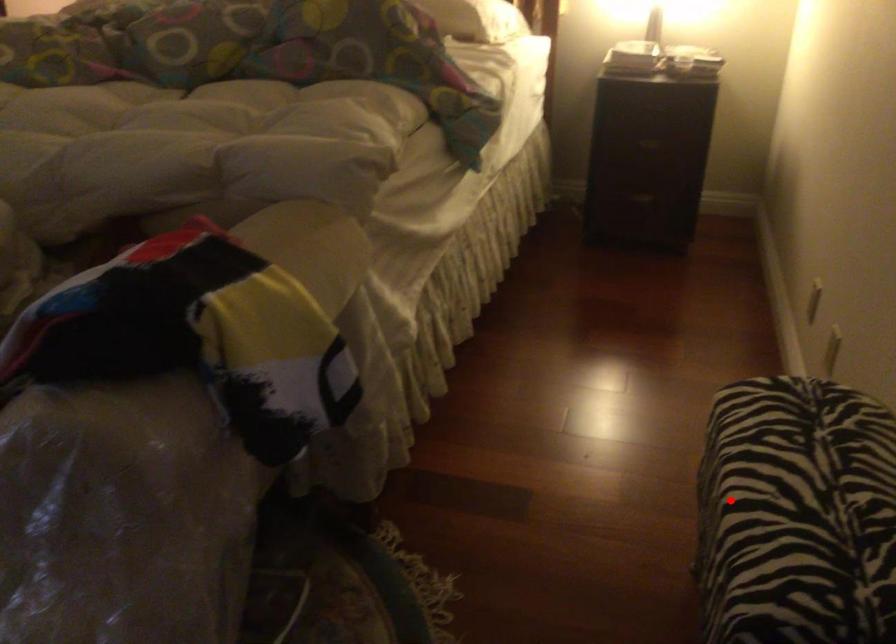
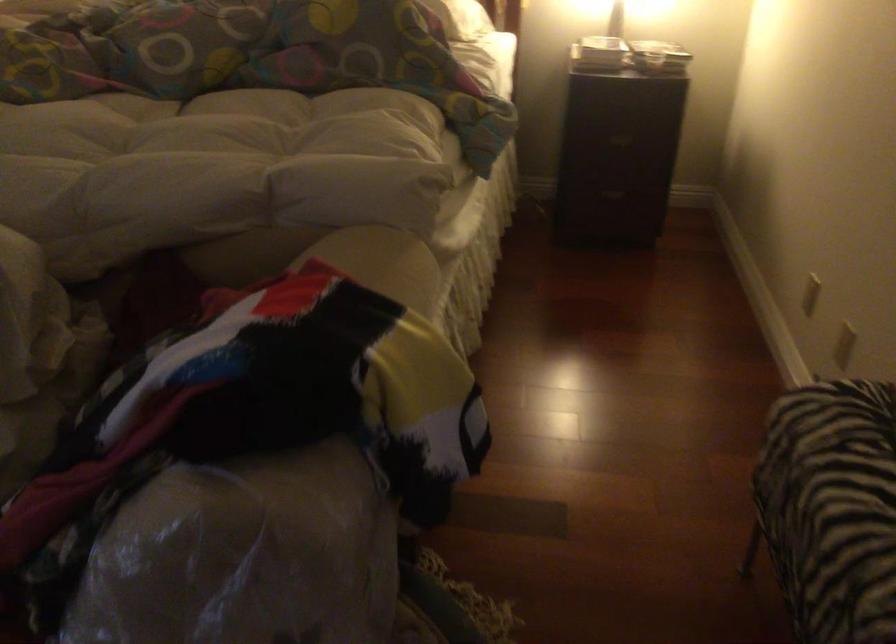
The point at the highlighted location is marked in the first image. Where is the corresponding point in the second image?

(831, 507)